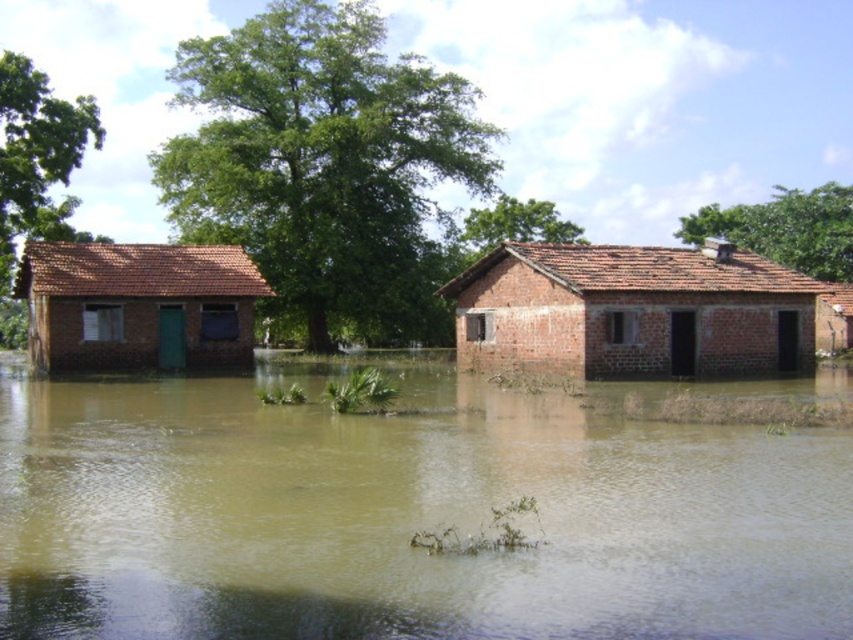
Between brown muddy water at center and brick house at right, which one is positioned lower?

brown muddy water at center

The image size is (853, 640). Find the location of `brown muddy water at center`. brown muddy water at center is located at coordinates (405, 518).

Can you confirm if brown muddy water at center is positioned to the left of matte brick house at left?

Incorrect, brown muddy water at center is not on the left side of matte brick house at left.

Measure the distance between brown muddy water at center and matte brick house at left.

The distance of brown muddy water at center from matte brick house at left is 13.70 meters.

Is point (202, 429) less distant than point (106, 324)?

Yes, point (202, 429) is closer to viewer.

Find the location of a particular element. This screenshot has width=853, height=640. brown muddy water at center is located at coordinates (405, 518).

Can you confirm if brick house at right is smaller than matte brick house at left?

No, brick house at right is not smaller than matte brick house at left.

Does brick house at right appear over matte brick house at left?

No, brick house at right is not above matte brick house at left.

Is point (799, 317) closer to viewer compared to point (160, 333)?

That is True.

At what (x,y) coordinates should I click in order to perform the action: click on brick house at right. Please return your answer as a coordinate pair (x, y). Looking at the image, I should click on (631, 310).